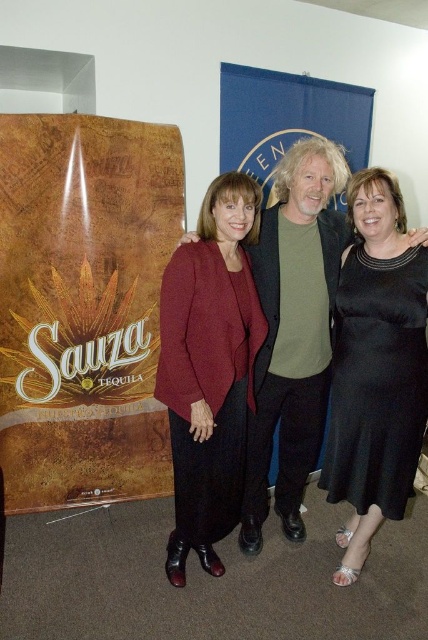
You are at the promotional event and want to take a photo with the brown wood grain poster at left and the black satin dress at center. Which object is wider?

The brown wood grain poster at left is wider than the black satin dress at center according to the description.

Based on the scene description, where exactly is the brown wood grain poster at left located in the image?

The brown wood grain poster at left is located at point (83, 305).

What object is located at the coordinates point [83,305] in the image?

The point [83,305] corresponds to the brown wood grain poster at left.